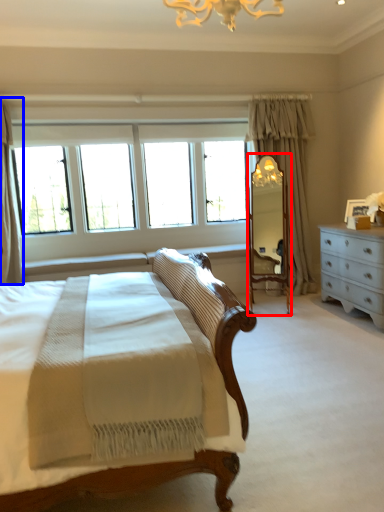
Question: Which point is closer to the camera, mirror (highlighted by a red box) or curtain (highlighted by a blue box)?

Choices:
 (A) mirror
 (B) curtain

Answer: (B)